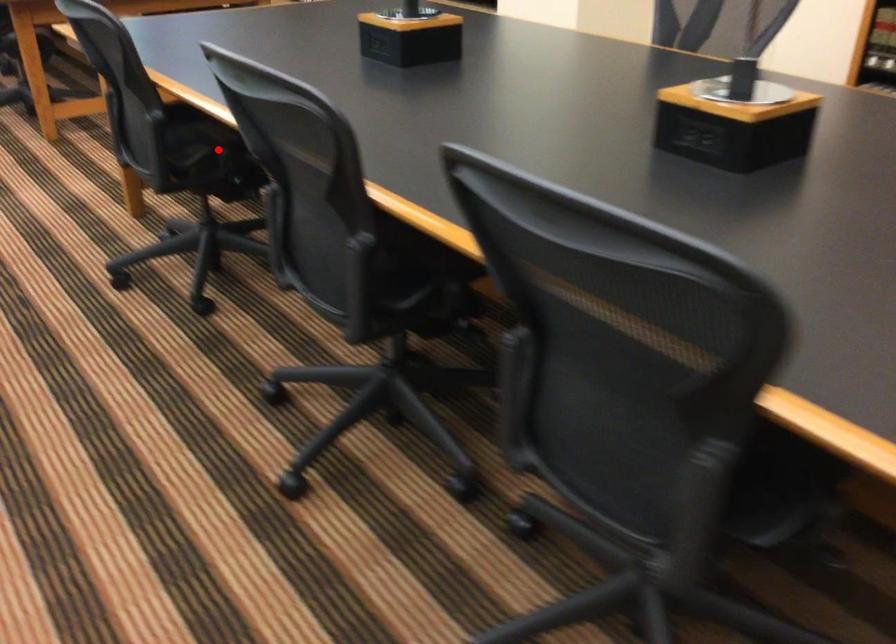
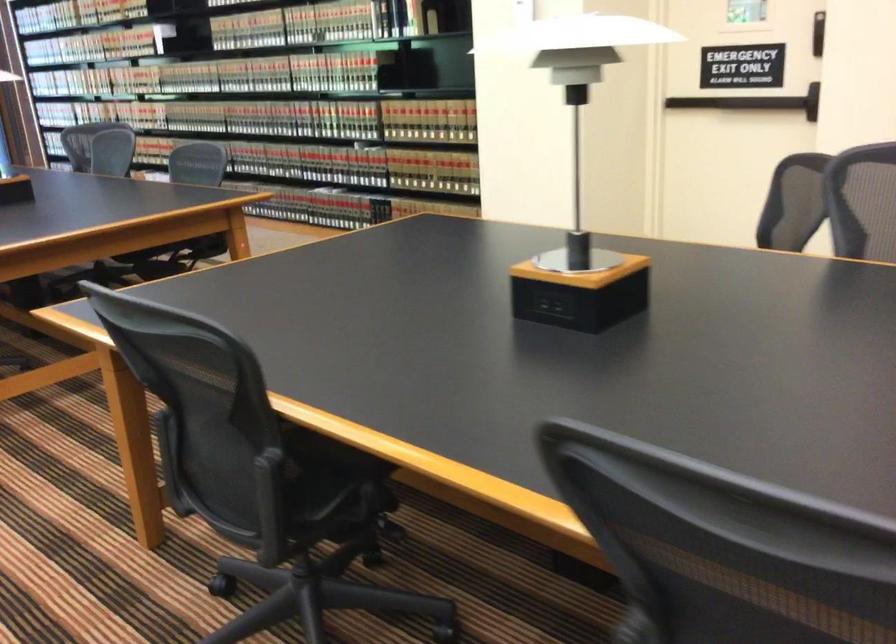
Question: I am providing you with two images of the same scene from different viewpoints. A red point is marked on the first image. At the location where the point appears in image 1, is it still visible in image 2?

Choices:
 (A) Yes
 (B) No

Answer: (A)